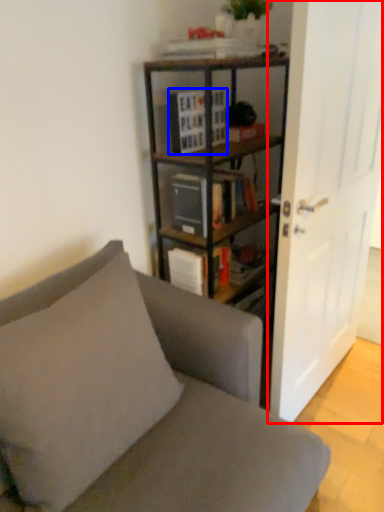
Question: Which point is further to the camera, door (highlighted by a red box) or book (highlighted by a blue box)?

Choices:
 (A) door
 (B) book

Answer: (B)